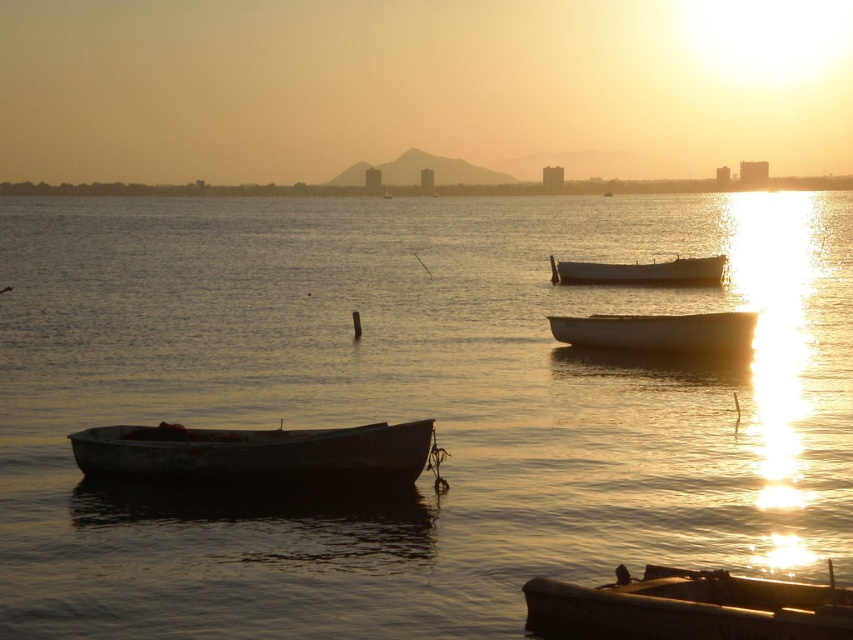
You are standing on the dock and want to throw a stone into the water. If you aim for the smooth water at center and the rusty metal boat at left, which area is wider for the stone to land?

The smooth water at center is wider than the rusty metal boat at left, so the stone has a better chance of landing there.

You are standing on the dock and see two points marked in the water. The first point is at coordinates point [527,484] and the second is at point [363,484]. Which point is closer to you?

Point [527,484] is closer to you because it is further to the viewer than point [363,484].